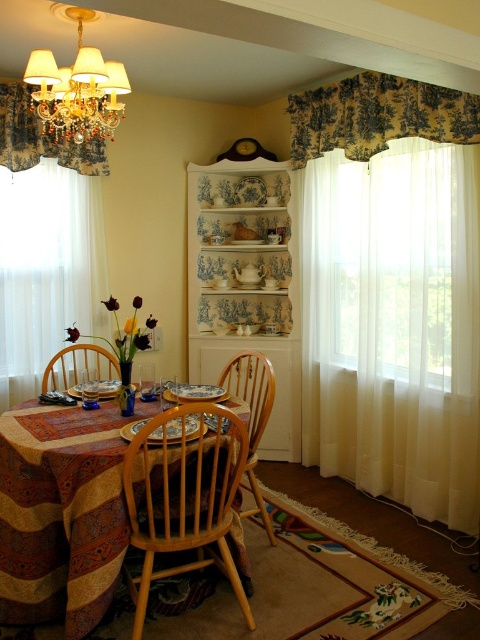
Question: Can you confirm if striped fabric table at center is wider than toile fabric valance at upper right?

Choices:
 (A) no
 (B) yes

Answer: (A)

Question: Which point is closer to the camera?

Choices:
 (A) toile fabric valance at upper right
 (B) white sheer curtain at left
 (C) light wood chair at center

Answer: (C)

Question: Estimate the real-world distances between objects in this image. Which object is closer to the wooden chair at table?

Choices:
 (A) striped fabric table at center
 (B) light wood chair at center

Answer: (A)

Question: Can you confirm if striped fabric table at center is positioned below wooden chair at center?

Choices:
 (A) yes
 (B) no

Answer: (A)

Question: Considering the relative positions of white sheer curtain at left and wooden chair at table in the image provided, where is white sheer curtain at left located with respect to wooden chair at table?

Choices:
 (A) above
 (B) below

Answer: (A)

Question: Which of the following is the farthest from the observer?

Choices:
 (A) (26, 168)
 (B) (72, 506)
 (C) (264, 364)
 (D) (70, 134)

Answer: (D)